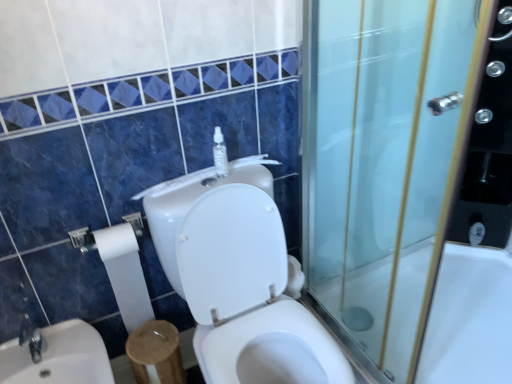
Question: Does clear plastic bottle at upper center have a greater width compared to white glossy bathtub at right?

Choices:
 (A) no
 (B) yes

Answer: (A)

Question: From the image's perspective, would you say clear plastic bottle at upper center is positioned over white glossy bathtub at right?

Choices:
 (A) yes
 (B) no

Answer: (A)

Question: Is clear plastic bottle at upper center not inside white glossy bathtub at right?

Choices:
 (A) no
 (B) yes

Answer: (B)

Question: Is clear plastic bottle at upper center far away from white glossy bathtub at right?

Choices:
 (A) yes
 (B) no

Answer: (A)

Question: From the image's perspective, would you say clear plastic bottle at upper center is shown under white glossy bathtub at right?

Choices:
 (A) yes
 (B) no

Answer: (B)

Question: In terms of height, does clear plastic bottle at upper center look taller or shorter compared to transparent glass screen door at right?

Choices:
 (A) short
 (B) tall

Answer: (A)

Question: In terms of width, does clear plastic bottle at upper center look wider or thinner when compared to transparent glass screen door at right?

Choices:
 (A) thin
 (B) wide

Answer: (A)

Question: From the image's perspective, is clear plastic bottle at upper center located above or below transparent glass screen door at right?

Choices:
 (A) above
 (B) below

Answer: (A)

Question: In the image, is clear plastic bottle at upper center positioned in front of or behind transparent glass screen door at right?

Choices:
 (A) front
 (B) behind

Answer: (B)

Question: Considering the positions of point (364, 167) and point (214, 140), is point (364, 167) closer or farther from the camera than point (214, 140)?

Choices:
 (A) closer
 (B) farther

Answer: (B)

Question: Is transparent glass screen door at right spatially inside clear plastic bottle at upper center, or outside of it?

Choices:
 (A) outside
 (B) inside

Answer: (A)

Question: From a real-world perspective, is transparent glass screen door at right positioned above or below clear plastic bottle at upper center?

Choices:
 (A) below
 (B) above

Answer: (A)

Question: Considering their positions, is transparent glass screen door at right located in front of or behind clear plastic bottle at upper center?

Choices:
 (A) front
 (B) behind

Answer: (A)

Question: Choose the correct answer: Is white glossy toilet at center inside white glossy sink at lower left or outside it?

Choices:
 (A) outside
 (B) inside

Answer: (A)

Question: Considering the positions of white glossy toilet at center and white glossy sink at lower left in the image, is white glossy toilet at center wider or thinner than white glossy sink at lower left?

Choices:
 (A) thin
 (B) wide

Answer: (B)